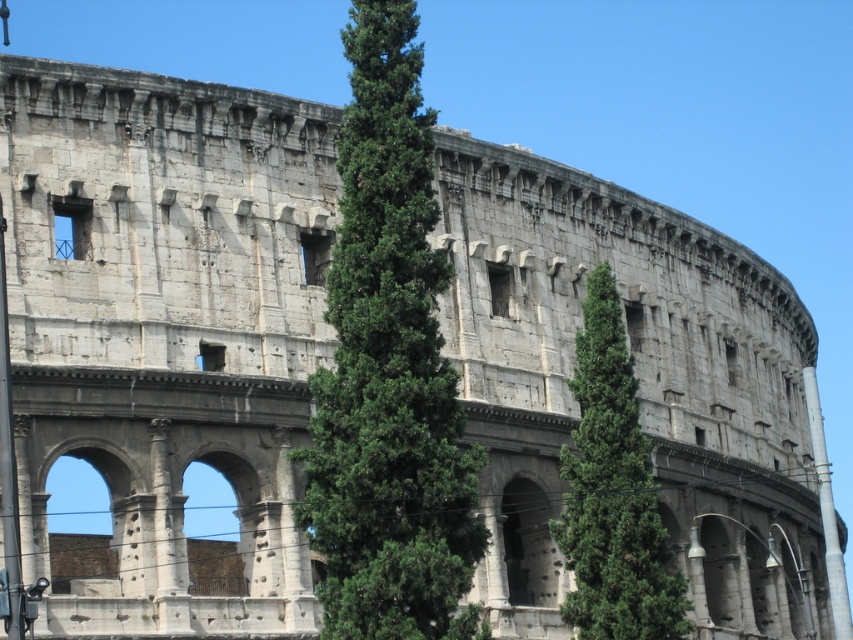
Question: Which of the following is the closest to the observer?

Choices:
 (A) green leafy tree at center
 (B) green textured tree at center

Answer: (A)

Question: Among these points, which one is farthest from the camera?

Choices:
 (A) (349, 452)
 (B) (665, 570)

Answer: (B)

Question: Is green leafy tree at center in front of green textured tree at center?

Choices:
 (A) yes
 (B) no

Answer: (A)

Question: Is green leafy tree at center below green textured tree at center?

Choices:
 (A) yes
 (B) no

Answer: (B)

Question: Which point is farther to the camera?

Choices:
 (A) (453, 536)
 (B) (592, 346)

Answer: (B)

Question: Is green leafy tree at center positioned before green textured tree at center?

Choices:
 (A) yes
 (B) no

Answer: (A)